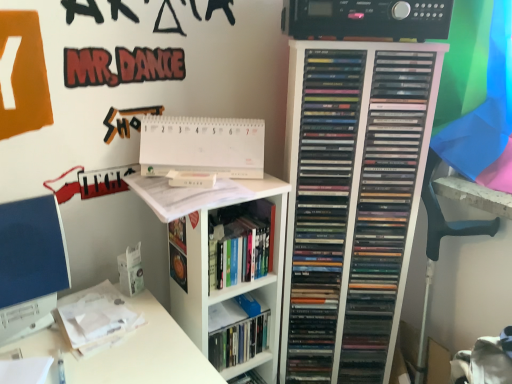
Question: Does white paper at upper center, the 1th paperback book when ordered from top to bottom, have a greater height compared to hardcover book at center?

Choices:
 (A) yes
 (B) no

Answer: (A)

Question: Is white paper at upper center, the 2th paperback book when ordered from bottom to top, facing towards hardcover book at center?

Choices:
 (A) no
 (B) yes

Answer: (A)

Question: Does white paper at upper center, the 1th paperback book when ordered from top to bottom, have a smaller size compared to hardcover book at center?

Choices:
 (A) no
 (B) yes

Answer: (B)

Question: Does white paper at upper center, the 1th paperback book when ordered from top to bottom, come in front of hardcover book at center?

Choices:
 (A) no
 (B) yes

Answer: (A)

Question: From a real-world perspective, is white paper at upper center, the 2th paperback book when ordered from bottom to top, on hardcover book at center?

Choices:
 (A) no
 (B) yes

Answer: (B)

Question: Is point (214, 289) positioned closer to the camera than point (429, 175)?

Choices:
 (A) closer
 (B) farther

Answer: (A)

Question: Considering the positions of white glossy bookshelf at upper center and black plastic swivel chair at right in the image, is white glossy bookshelf at upper center wider or thinner than black plastic swivel chair at right?

Choices:
 (A) wide
 (B) thin

Answer: (A)

Question: From a real-world perspective, relative to black plastic swivel chair at right, is white glossy bookshelf at upper center vertically above or below?

Choices:
 (A) below
 (B) above

Answer: (A)

Question: Is white glossy bookshelf at upper center inside the boundaries of black plastic swivel chair at right, or outside?

Choices:
 (A) inside
 (B) outside

Answer: (B)

Question: From a real-world perspective, is white glossy bookshelf at upper center positioned above or below black plastic stereo at upper center?

Choices:
 (A) below
 (B) above

Answer: (A)

Question: In the image, is white glossy bookshelf at upper center on the left side or the right side of black plastic stereo at upper center?

Choices:
 (A) left
 (B) right

Answer: (A)

Question: Choose the correct answer: Is white glossy bookshelf at upper center inside black plastic stereo at upper center or outside it?

Choices:
 (A) inside
 (B) outside

Answer: (B)

Question: In terms of width, does white glossy bookshelf at upper center look wider or thinner when compared to black plastic stereo at upper center?

Choices:
 (A) wide
 (B) thin

Answer: (A)

Question: From the image's perspective, is hardcover book at center above or below white glossy bookshelf at upper center?

Choices:
 (A) above
 (B) below

Answer: (A)

Question: Is hardcover book at center to the left or to the right of white glossy bookshelf at upper center in the image?

Choices:
 (A) right
 (B) left

Answer: (A)